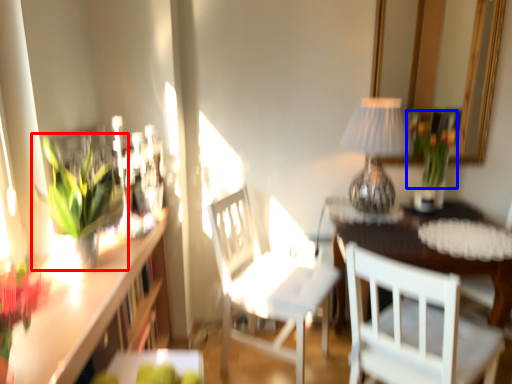
Question: Which point is closer to the camera, houseplant (highlighted by a red box) or floral arrangement (highlighted by a blue box)?

Choices:
 (A) houseplant
 (B) floral arrangement

Answer: (A)